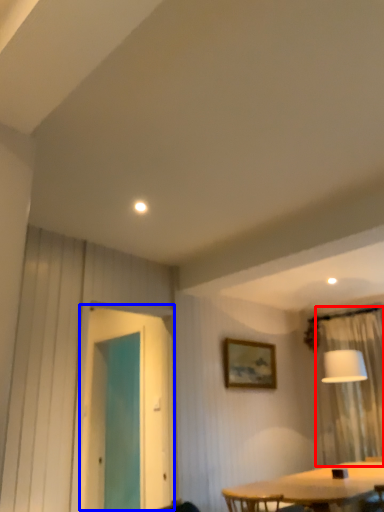
Question: Which object appears closest to the camera in this image, curtain (highlighted by a red box) or screen door (highlighted by a blue box)?

Choices:
 (A) curtain
 (B) screen door

Answer: (B)